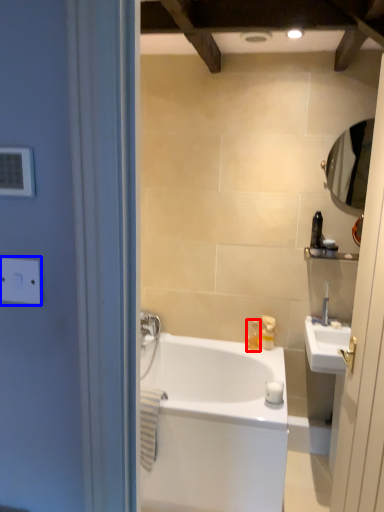
Question: Among these objects, which one is nearest to the camera, toiletry (highlighted by a red box) or electric outlet (highlighted by a blue box)?

Choices:
 (A) toiletry
 (B) electric outlet

Answer: (B)